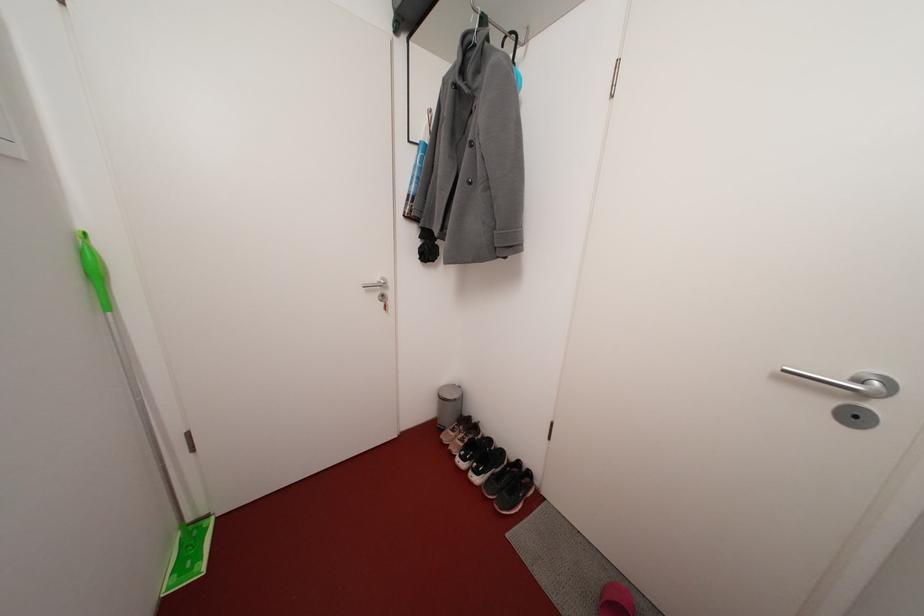
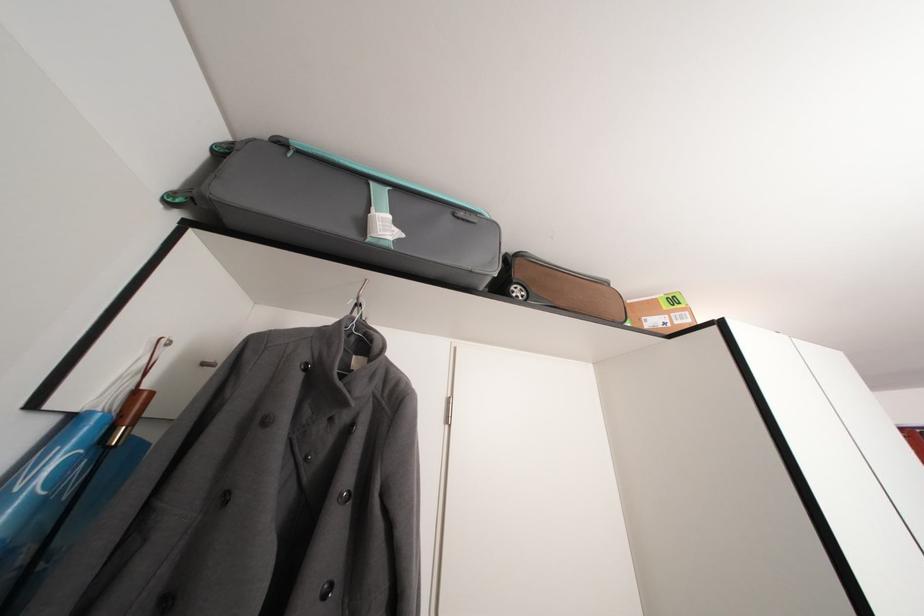
The images are taken continuously from a first-person perspective. In which direction is your viewpoint rotating?

The camera rotated toward right-up.